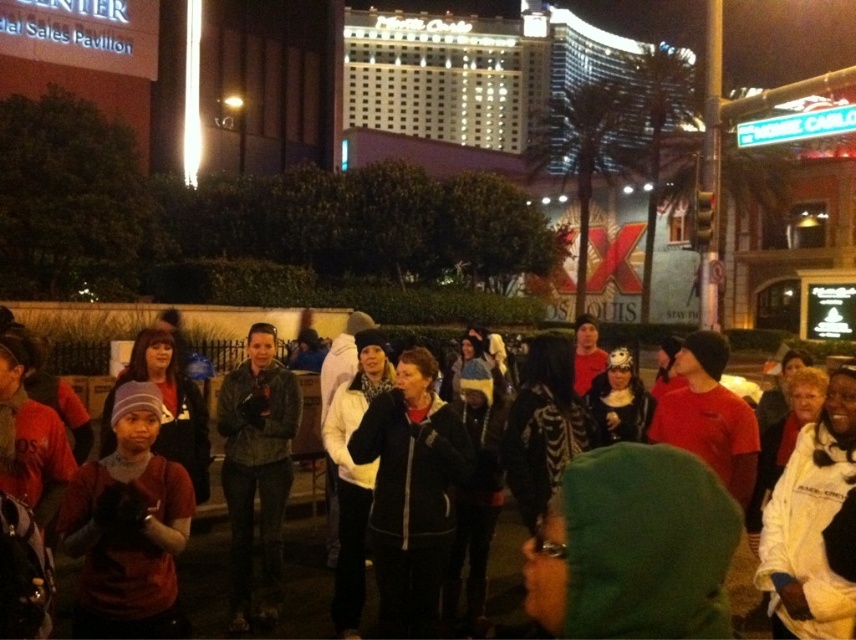
Is matte red shirt at center positioned in front of black fleece jacket at center?

Yes, it is in front of black fleece jacket at center.

Which of these two, matte red shirt at center or black fleece jacket at center, stands taller?

black fleece jacket at center is taller.

Does point (74, 536) come closer to viewer compared to point (351, 452)?

Yes, it is.

Locate an element on the screen. The height and width of the screenshot is (640, 856). matte red shirt at center is located at coordinates (128, 525).

Can you confirm if black fleece jacket at center is bigger than leather jacket at center?

No, black fleece jacket at center is not bigger than leather jacket at center.

Looking at this image, does black fleece jacket at center lie behind leather jacket at center?

No, it is not.

The image size is (856, 640). I want to click on black fleece jacket at center, so click(x=411, y=492).

Is point (66, 502) less distant than point (235, 582)?

Yes, point (66, 502) is in front of point (235, 582).

Between matte red shirt at center and leather jacket at center, which one appears on the right side from the viewer's perspective?

leather jacket at center is more to the right.

Does point (147, 397) come closer to viewer compared to point (230, 563)?

Yes, point (147, 397) is in front of point (230, 563).

Locate an element on the screen. This screenshot has height=640, width=856. matte red shirt at center is located at coordinates (128, 525).